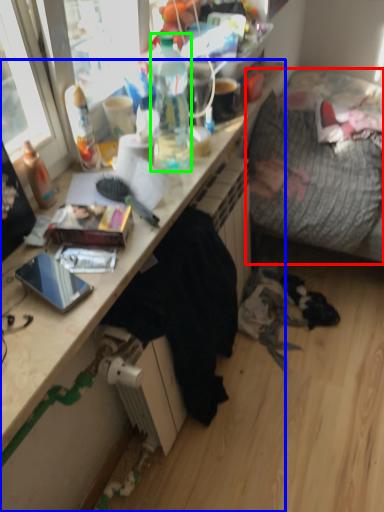
Question: Estimate the real-world distances between objects in this image. Which object is farther from studio couch (highlighted by a red box), desk (highlighted by a blue box) or bottle (highlighted by a green box)?

Choices:
 (A) desk
 (B) bottle

Answer: (A)